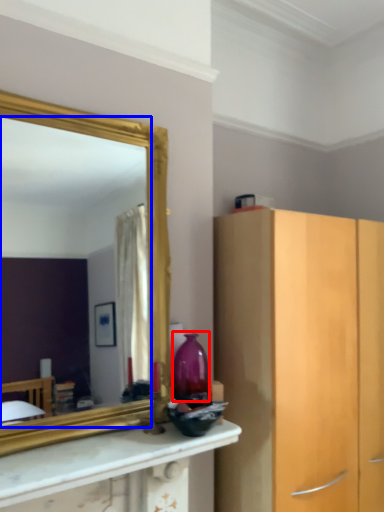
Question: Which object appears closest to the camera in this image, vase (highlighted by a red box) or mirror (highlighted by a blue box)?

Choices:
 (A) vase
 (B) mirror

Answer: (B)